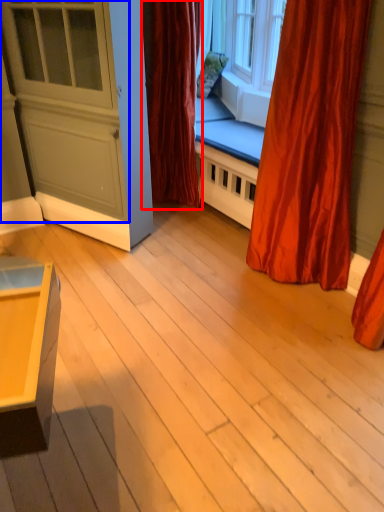
Question: Which object appears farthest to the camera in this image, curtain (highlighted by a red box) or screen door (highlighted by a blue box)?

Choices:
 (A) curtain
 (B) screen door

Answer: (A)